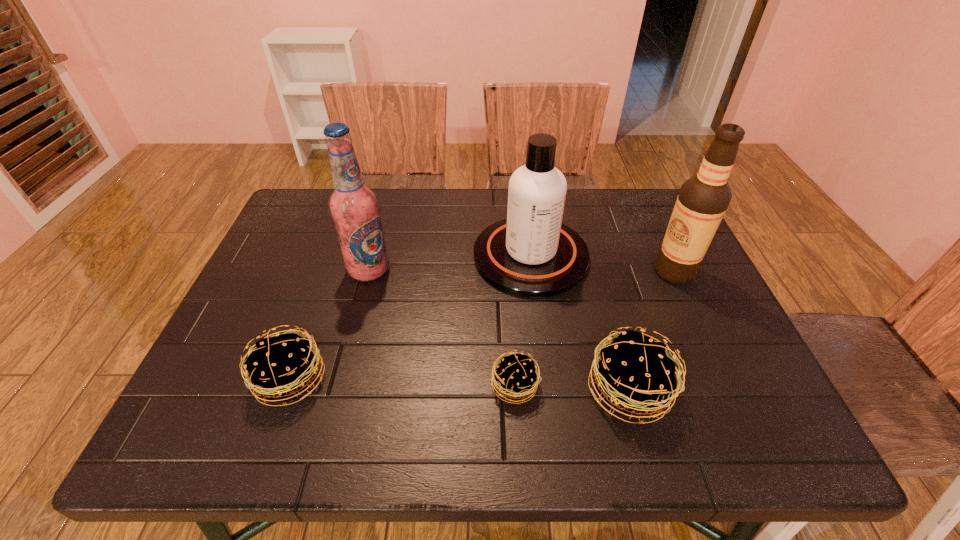
Please mark a free spot for a new patty_(food) to balance the arrangement. Please provide its 2D coordinates. Your answer should be formatted as a tuple, i.e. [(x, y)], where the tuple contains the x and y coordinates of a point satisfying the conditions above.

[(402, 382)]